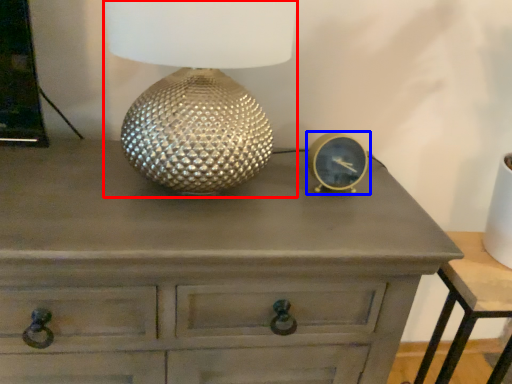
Question: Which object appears closest to the camera in this image, table lamp (highlighted by a red box) or pocket watch (highlighted by a blue box)?

Choices:
 (A) table lamp
 (B) pocket watch

Answer: (A)